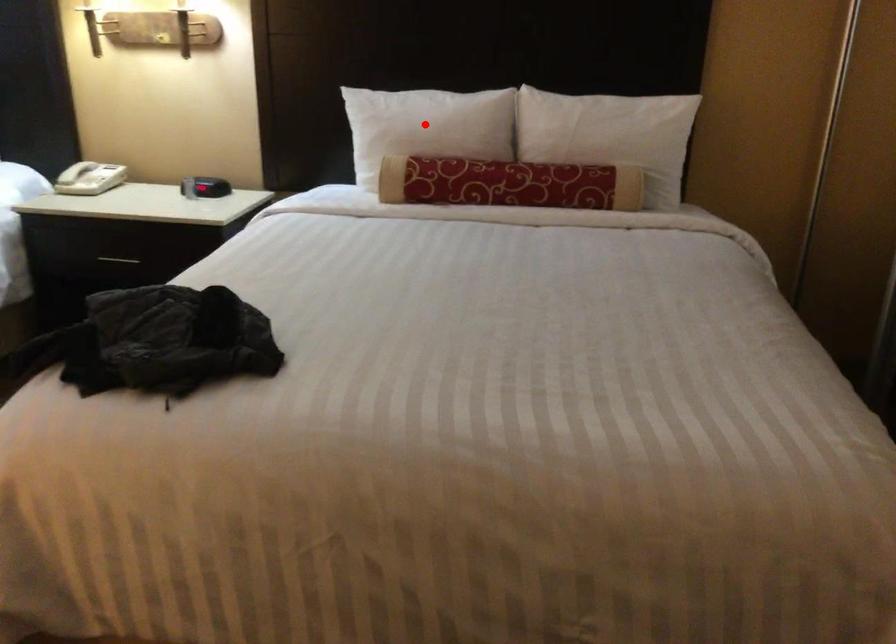
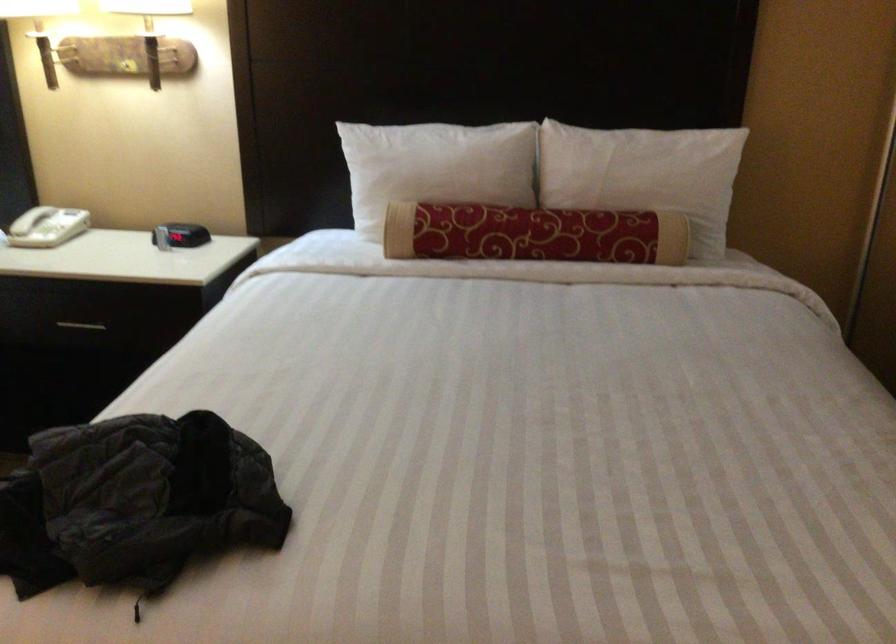
In the second image, find the point that corresponds to the highlighted location in the first image.

(435, 167)